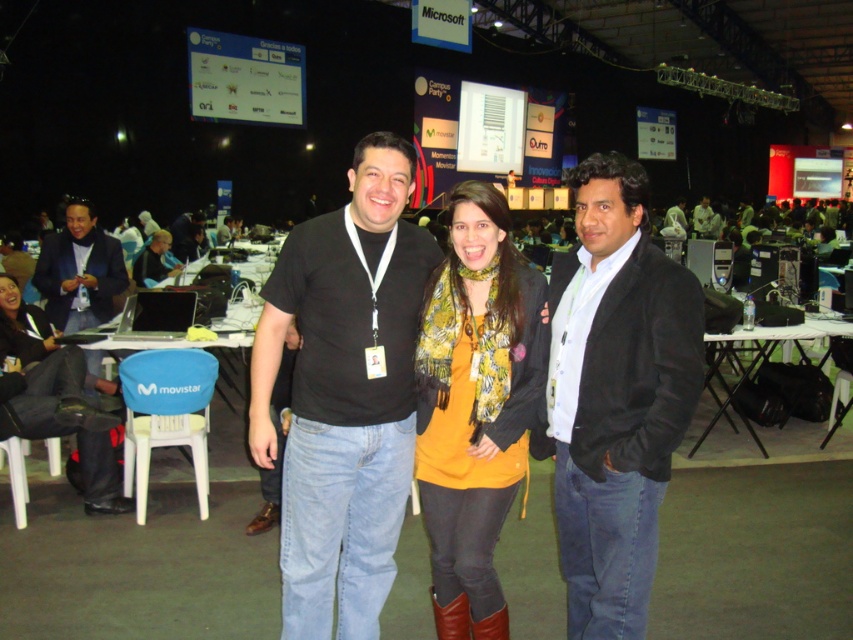
You are standing in the expo hall and see two points marked in the image. Which point, point (471, 332) or point (165, 237), is nearer to you?

Point (471, 332) is closer to the viewer than point (165, 237).

You are at a tech conference and need to present your slides. You see the yellow matte sweater at center and the matte black laptop at left. Which object is closer to the stage where you will present?

The yellow matte sweater at center is positioned under the matte black laptop at left, meaning it is closer to the stage since it is lower in the image.

You are organizing a tech conference and need to place a matte black laptop at left and a leather boot at lower center on a small table. The table has limited space. Which object should you place first to ensure both fit?

The leather boot at lower center should be placed first since the matte black laptop at left is larger in size and will require more space, ensuring both can fit by starting with the smaller item.